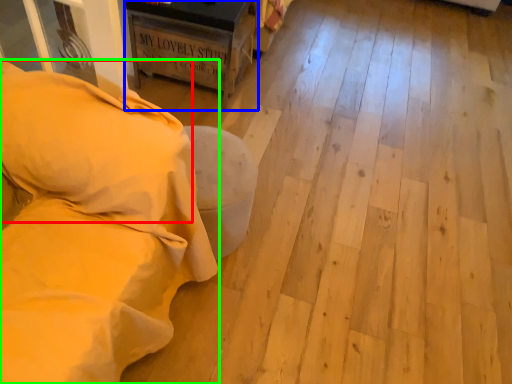
Question: Estimate the real-world distances between objects in this image. Which object is farther from pillow (highlighted by a red box), furniture (highlighted by a blue box) or furniture (highlighted by a green box)?

Choices:
 (A) furniture
 (B) furniture

Answer: (A)